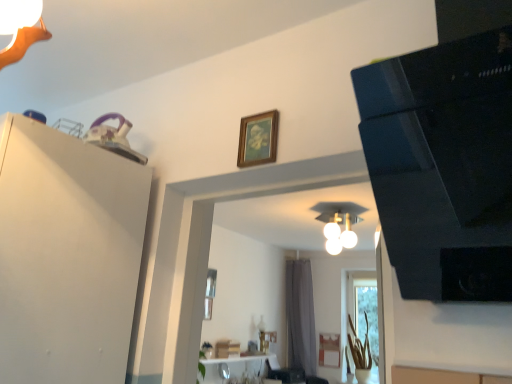
Question: From a real-world perspective, is gray fabric curtain at center above or below translucent glass vase at lower right?

Choices:
 (A) below
 (B) above

Answer: (B)

Question: Considering the positions of point tap(309, 362) and point tap(365, 322), is point tap(309, 362) closer or farther from the camera than point tap(365, 322)?

Choices:
 (A) closer
 (B) farther

Answer: (B)

Question: Based on their relative distances, which object is farther from the gray fabric curtain at center?

Choices:
 (A) black glossy speaker at upper right
 (B) translucent glass vase at lower right
 (C) wooden picture frame at upper center
 (D) white matte dresser at upper left
 (E) white glossy light fixture at center

Answer: (A)

Question: Based on their relative distances, which object is nearer to the white matte dresser at upper left?

Choices:
 (A) white glossy light fixture at center
 (B) gray fabric curtain at center
 (C) translucent glass vase at lower right
 (D) wooden picture frame at upper center
 (E) black glossy speaker at upper right

Answer: (D)